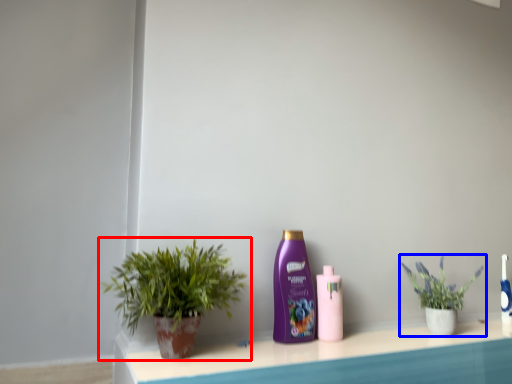
Question: Among these objects, which one is nearest to the camera, houseplant (highlighted by a red box) or houseplant (highlighted by a blue box)?

Choices:
 (A) houseplant
 (B) houseplant

Answer: (A)